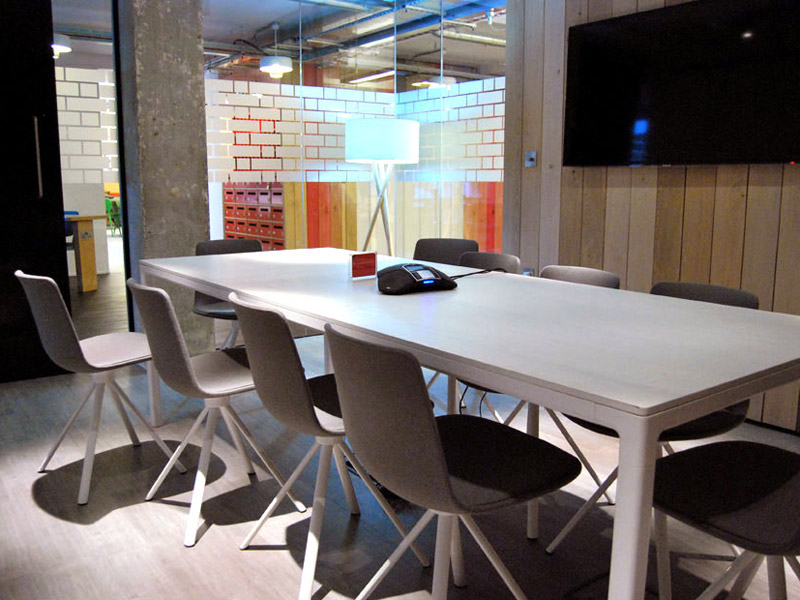
In order to click on teleision in this screenshot , I will do `click(666, 103)`.